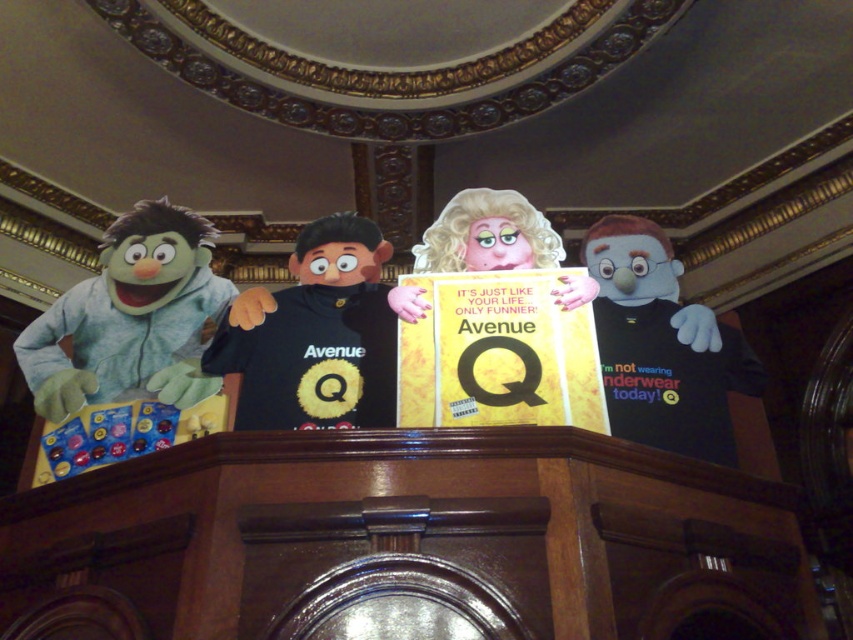
Describe the element at coordinates (131, 317) in the screenshot. I see `gray plush puppet at left` at that location.

Is point (212, 228) in front of point (254, 428)?

No, (212, 228) is behind (254, 428).

Is point (51, 401) positioned in front of point (352, 426)?

No, (51, 401) is further to viewer.

At what (x,y) coordinates should I click in order to perform the action: click on gray plush puppet at left. Please return your answer as a coordinate pair (x, y). Looking at the image, I should click on (131, 317).

Identify the location of black matte t-shirt at center. The image size is (853, 640). (314, 337).

Is black matte t-shirt at center bigger than black matte t-shirt at right?

Actually, black matte t-shirt at center might be smaller than black matte t-shirt at right.

Is point (368, 232) positioned after point (705, 433)?

Yes.

Where is `black matte t-shirt at center`? This screenshot has width=853, height=640. black matte t-shirt at center is located at coordinates (314, 337).

Which is behind, point (115, 339) or point (646, 371)?

Positioned behind is point (115, 339).

Who is shorter, gray plush puppet at left or black matte t-shirt at right?

With less height is gray plush puppet at left.

Locate an element on the screen. gray plush puppet at left is located at coordinates (131, 317).